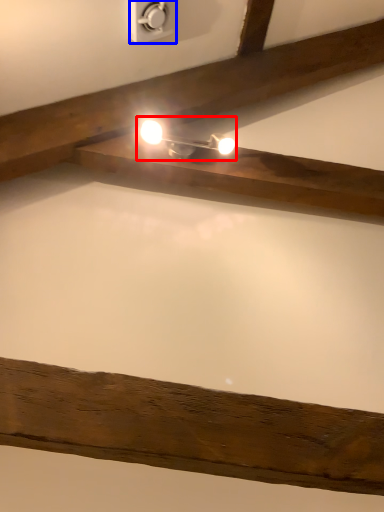
Question: Which object appears closest to the camera in this image, light fixture (highlighted by a red box) or power plugs and sockets (highlighted by a blue box)?

Choices:
 (A) light fixture
 (B) power plugs and sockets

Answer: (B)